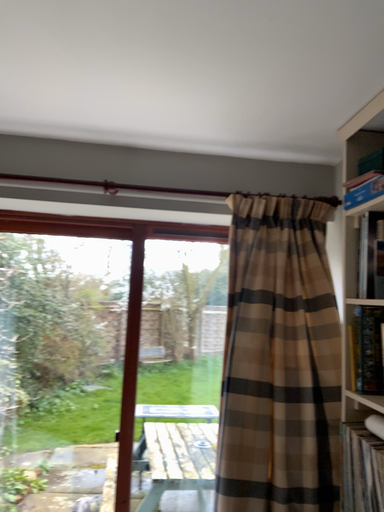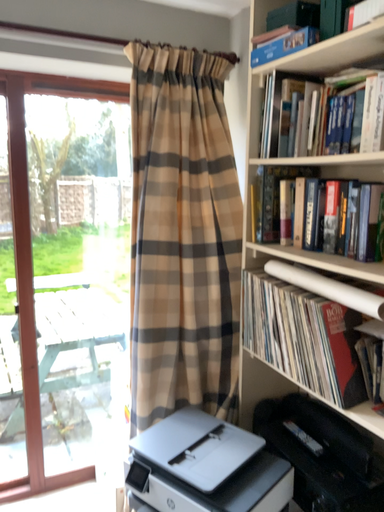
Question: Which way did the camera rotate in the video?

Choices:
 (A) rotated upward
 (B) rotated downward

Answer: (B)